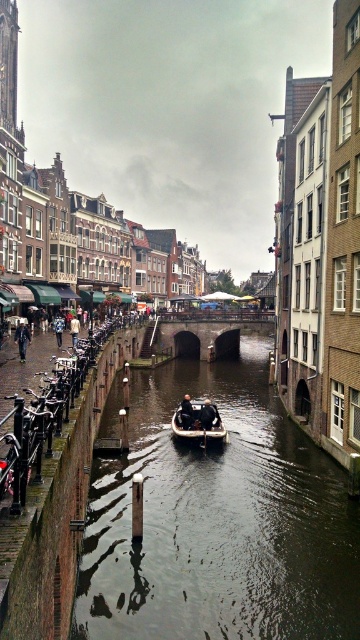
Is dark blue jeans at left further to the viewer compared to dark blue fabric jacket at center?

Yes, dark blue jeans at left is further from the viewer.

Who is positioned more to the left, dark blue jeans at left or dark blue fabric jacket at center?

dark blue jeans at left

Which is behind, point (16, 339) or point (180, 417)?

The point (16, 339) is behind.

The height and width of the screenshot is (640, 360). Identify the location of dark blue jeans at left. (21, 339).

Which of these two, white plastic boat at center or dark brown leather jacket at lower left, stands shorter?

white plastic boat at center

This screenshot has width=360, height=640. Describe the element at coordinates (198, 420) in the screenshot. I see `white plastic boat at center` at that location.

Between point (189, 403) and point (74, 340), which one is positioned behind?

The point (74, 340) is more distant.

The height and width of the screenshot is (640, 360). Find the location of `white plastic boat at center`. white plastic boat at center is located at coordinates (198, 420).

Is dark water at center positioned before white plastic boat at center?

Yes.

Does dark water at center appear under white plastic boat at center?

Yes.

Between point (109, 608) and point (217, 432), which one is positioned in front?

Point (109, 608) is in front.

Identify the location of dark water at center. Image resolution: width=360 pixels, height=640 pixels. (218, 522).